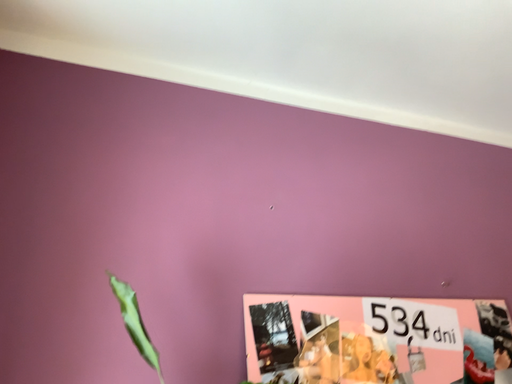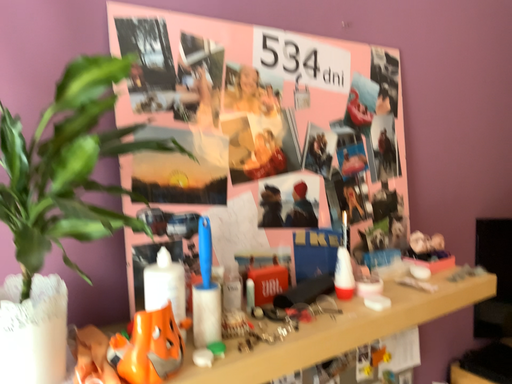
Question: Which way did the camera rotate in the video?

Choices:
 (A) rotated left
 (B) rotated right

Answer: (B)